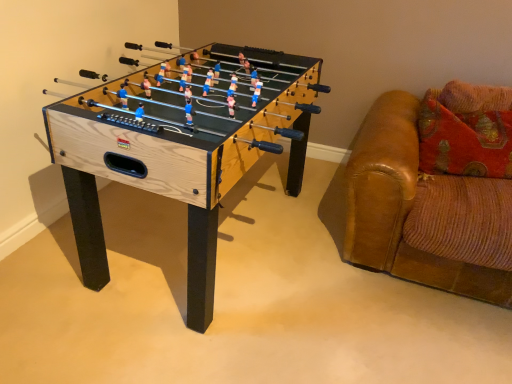
What do you see at coordinates (181, 153) in the screenshot? This screenshot has height=384, width=512. I see `wooden foosball table at center` at bounding box center [181, 153].

Image resolution: width=512 pixels, height=384 pixels. I want to click on wooden foosball table at center, so click(x=181, y=153).

The width and height of the screenshot is (512, 384). I want to click on wooden foosball table at center, so click(x=181, y=153).